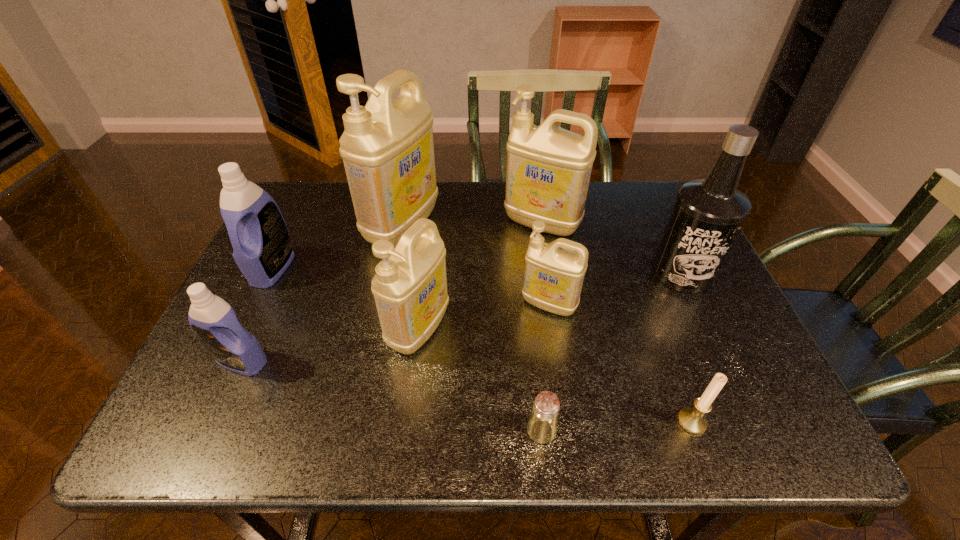
This screenshot has width=960, height=540. Find the location of `saltshaker`. saltshaker is located at coordinates point(542,425).

Locate an element on the screen. The width and height of the screenshot is (960, 540). vacant area situated 0.350m on the right of the tallest detergent is located at coordinates (562, 226).

The width and height of the screenshot is (960, 540). What are the coordinates of `vacant region located 0.160m on the front label of the liquor` in the screenshot? It's located at 717,349.

The height and width of the screenshot is (540, 960). I want to click on vacant region located 0.350m on the left of the third smallest beige detergent, so click(381, 224).

Image resolution: width=960 pixels, height=540 pixels. Identify the location of blank space located 0.270m on the right of the third biggest beige detergent. coord(569,329).

Image resolution: width=960 pixels, height=540 pixels. Find the location of `vacant space located 0.240m on the back of the farther blue detergent`. vacant space located 0.240m on the back of the farther blue detergent is located at coordinates (306, 198).

Locate an element on the screen. The height and width of the screenshot is (540, 960). free point located on the left of the smallest beige detergent is located at coordinates (382, 305).

In order to click on blank area located on the back of the nearer blue detergent in this screenshot , I will do `click(294, 247)`.

Locate an element on the screen. The height and width of the screenshot is (540, 960). vacant region located 0.070m on the back of the eighth object from left to right is located at coordinates (676, 377).

Where is `vacant region located 0.090m on the left of the saltshaker`? vacant region located 0.090m on the left of the saltshaker is located at coordinates (479, 430).